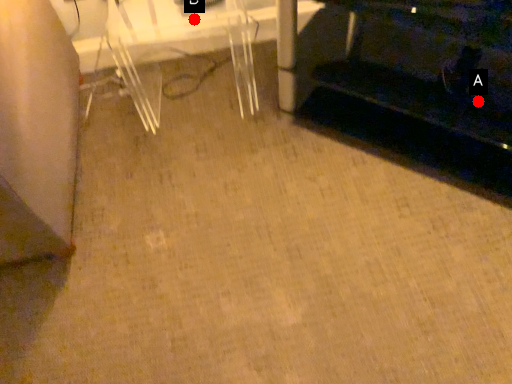
Question: Two points are circled on the image, labeled by A and B beside each circle. Which of the following is the farthest from the observer?

Choices:
 (A) A is further
 (B) B is further

Answer: (B)